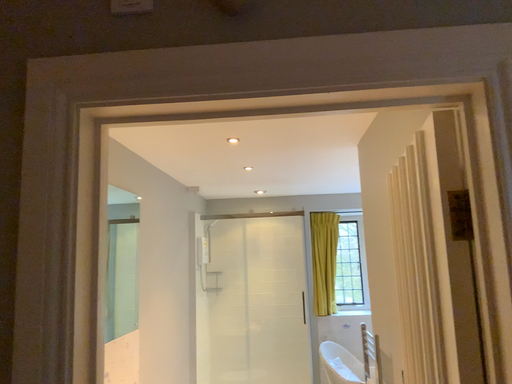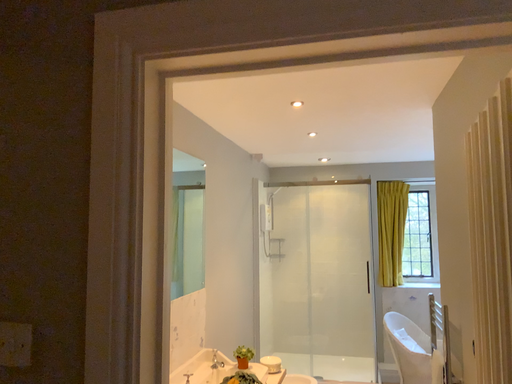
Question: Which way did the camera rotate in the video?

Choices:
 (A) rotated right
 (B) rotated left

Answer: (B)